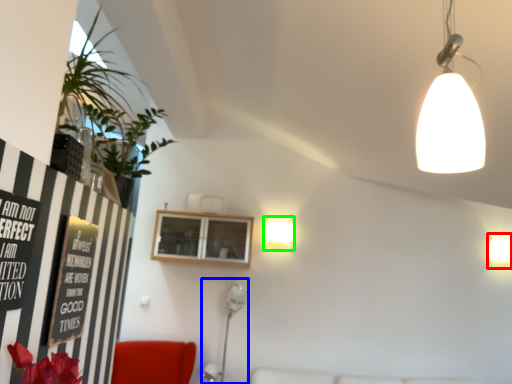
Question: Based on their relative distances, which object is nearer to lamp (highlighted by a red box)? Choose from fixture (highlighted by a blue box) and lamp (highlighted by a green box).

Choices:
 (A) fixture
 (B) lamp

Answer: (B)